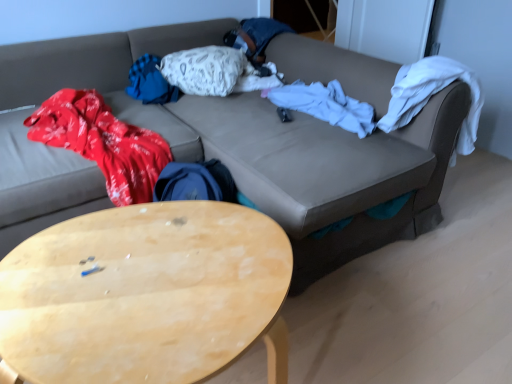
Question: Looking at their shapes, would you say white textured pillow at center is wider or thinner than light wood/wooden coffee table at lower left?

Choices:
 (A) wide
 (B) thin

Answer: (B)

Question: Is white textured pillow at center inside the boundaries of light wood/wooden coffee table at lower left, or outside?

Choices:
 (A) inside
 (B) outside

Answer: (B)

Question: Which is farther from the light wood/wooden coffee table at lower left?

Choices:
 (A) leather couch at center
 (B) white textured pillow at center
 (C) white soft blanket at center

Answer: (B)

Question: Considering the real-world distances, which object is closest to the light wood/wooden coffee table at lower left?

Choices:
 (A) white textured pillow at center
 (B) white soft blanket at center
 (C) leather couch at center

Answer: (C)